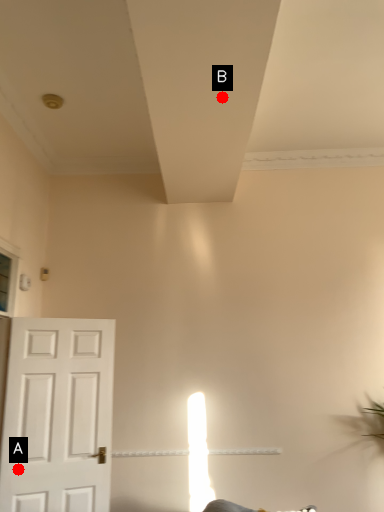
Question: Two points are circled on the image, labeled by A and B beside each circle. Which of the following is the farthest from the observer?

Choices:
 (A) A is further
 (B) B is further

Answer: (A)